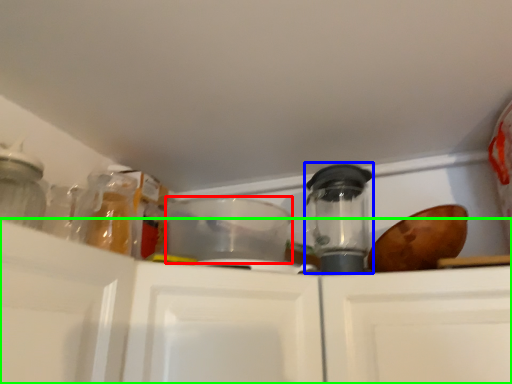
Question: Which object is positioned farthest from appliance (highlighted by a red box)? Select from appliance (highlighted by a blue box) and cabinetry (highlighted by a green box).

Choices:
 (A) appliance
 (B) cabinetry

Answer: (B)